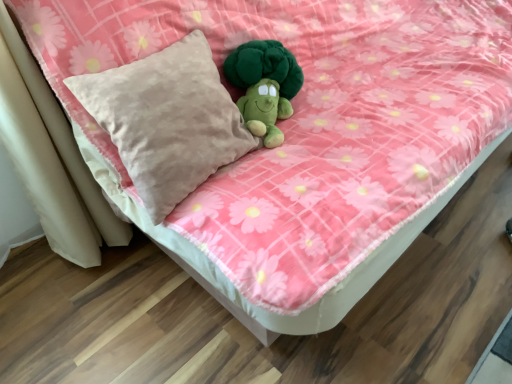
Where is `beige velvety pillow at upper left`? The image size is (512, 384). beige velvety pillow at upper left is located at coordinates (167, 120).

Measure the distance between point [191,86] and camera.

35.31 inches.

What do you see at coordinates (167, 120) in the screenshot?
I see `beige velvety pillow at upper left` at bounding box center [167, 120].

Identify the location of beige velvety pillow at upper left. The height and width of the screenshot is (384, 512). (167, 120).